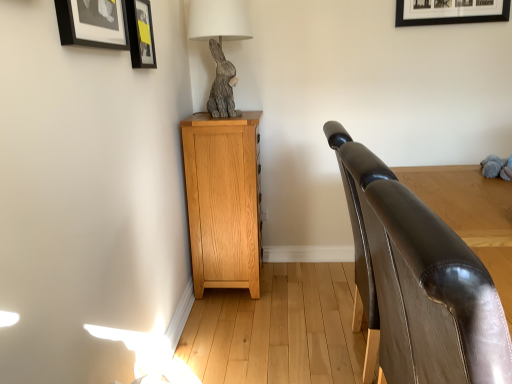
Question: Is shiny brown leather armrest at right shorter than matte black picture frame at upper left, which is the 1th picture frame from back to front?

Choices:
 (A) no
 (B) yes

Answer: (A)

Question: From the image's perspective, does shiny brown leather armrest at right appear lower than matte black picture frame at upper left, placed as the 2th picture frame when sorted from front to back?

Choices:
 (A) yes
 (B) no

Answer: (A)

Question: From a real-world perspective, is shiny brown leather armrest at right under matte black picture frame at upper left, which is the 1th picture frame from back to front?

Choices:
 (A) no
 (B) yes

Answer: (B)

Question: Is shiny brown leather armrest at right wider than matte black picture frame at upper left, which is the 1th picture frame from back to front?

Choices:
 (A) no
 (B) yes

Answer: (B)

Question: Can you confirm if shiny brown leather armrest at right is positioned to the left of matte black picture frame at upper left, which is the 1th picture frame from back to front?

Choices:
 (A) no
 (B) yes

Answer: (A)

Question: Which is correct: gray plush toy at right is inside matte black picture frame at upper left, placed as the 2th picture frame when sorted from front to back, or outside of it?

Choices:
 (A) inside
 (B) outside

Answer: (B)

Question: From the image's perspective, is gray plush toy at right positioned above or below matte black picture frame at upper left, placed as the 2th picture frame when sorted from front to back?

Choices:
 (A) below
 (B) above

Answer: (A)

Question: Looking at the image, does gray plush toy at right seem bigger or smaller compared to matte black picture frame at upper left, placed as the 2th picture frame when sorted from front to back?

Choices:
 (A) small
 (B) big

Answer: (B)

Question: Considering the positions of point (494, 170) and point (151, 66), is point (494, 170) closer or farther from the camera than point (151, 66)?

Choices:
 (A) closer
 (B) farther

Answer: (A)

Question: From the image's perspective, relative to gray textured rabbit at upper left, is matte black picture frame at upper left, which is the 1th picture frame from back to front, above or below?

Choices:
 (A) above
 (B) below

Answer: (B)

Question: Is point (141, 34) positioned closer to the camera than point (231, 16)?

Choices:
 (A) closer
 (B) farther

Answer: (A)

Question: Is matte black picture frame at upper left, placed as the 2th picture frame when sorted from front to back, to the left or to the right of gray textured rabbit at upper left in the image?

Choices:
 (A) left
 (B) right

Answer: (A)

Question: In terms of height, does matte black picture frame at upper left, placed as the 2th picture frame when sorted from front to back, look taller or shorter compared to gray textured rabbit at upper left?

Choices:
 (A) tall
 (B) short

Answer: (B)

Question: From the image's perspective, relative to light oak cabinet at left, is shiny brown leather armrest at right above or below?

Choices:
 (A) below
 (B) above

Answer: (A)

Question: Based on their positions, is shiny brown leather armrest at right located to the left or right of light oak cabinet at left?

Choices:
 (A) right
 (B) left

Answer: (A)